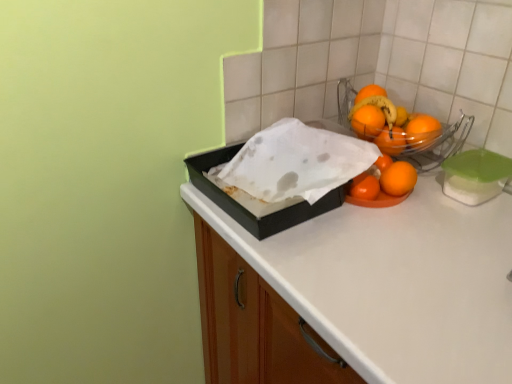
Question: In terms of height, does orange matte/orange at center, the 1th orange from the bottom, look taller or shorter compared to orange matte at upper right, the 4th orange positioned from the bottom?

Choices:
 (A) short
 (B) tall

Answer: (B)

Question: Considering the positions of orange matte/orange at center, which appears as the 4th orange when viewed from the top, and orange matte at upper right, arranged as the first orange when viewed from the top, in the image, is orange matte/orange at center, which appears as the 4th orange when viewed from the top, wider or thinner than orange matte at upper right, arranged as the first orange when viewed from the top,?

Choices:
 (A) wide
 (B) thin

Answer: (A)

Question: Which object is positioned farthest from the orange matte at right, arranged as the 3th orange when ordered from the bottom?

Choices:
 (A) shiny orange oranges at upper right
 (B) black matte box at center
 (C) orange matte at right, which ranks as the second orange in bottom-to-top order
 (D) orange matte at upper right, the 4th orange positioned from the bottom
 (E) orange matte/orange at center, which appears as the 4th orange when viewed from the top

Answer: (B)

Question: Which object is the farthest from the orange matte at right, arranged as the 3th orange when ordered from the bottom?

Choices:
 (A) orange matte at upper right, the 4th orange positioned from the bottom
 (B) black matte box at center
 (C) orange matte at right, marked as the third orange in a top-to-bottom arrangement
 (D) shiny orange oranges at upper right
 (E) orange matte/orange at center, which appears as the 4th orange when viewed from the top

Answer: (B)